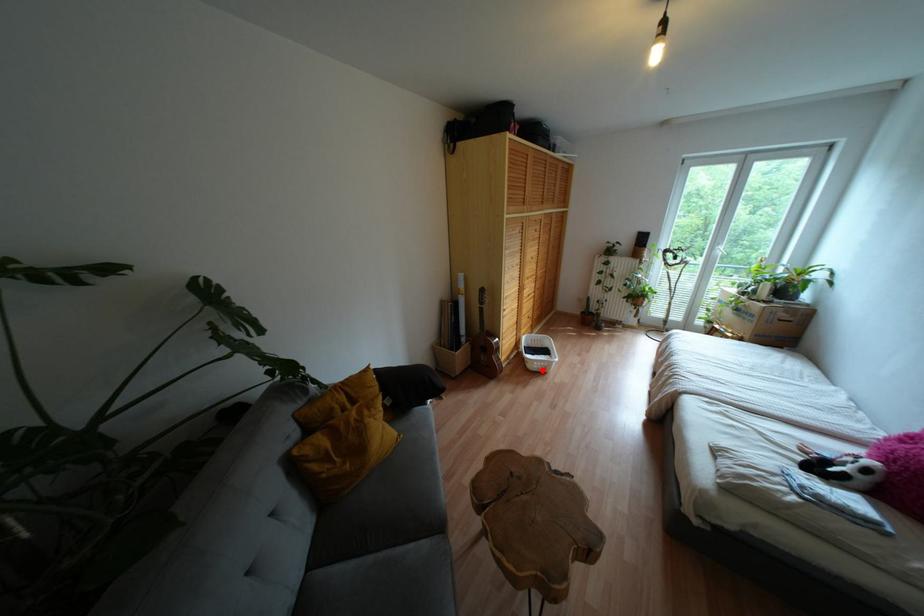
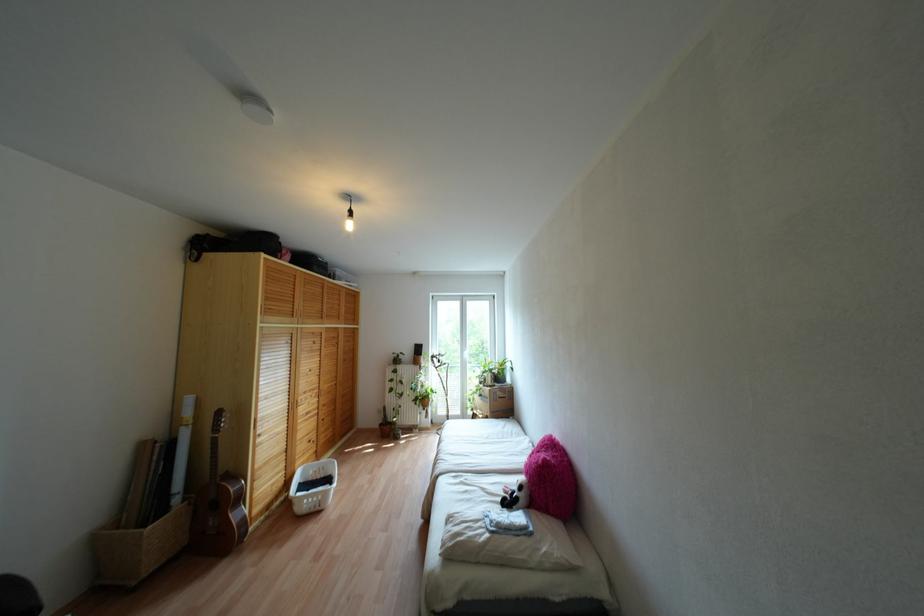
Where in the second image is the point corresponding to the highlighted location from the first image?

(317, 508)